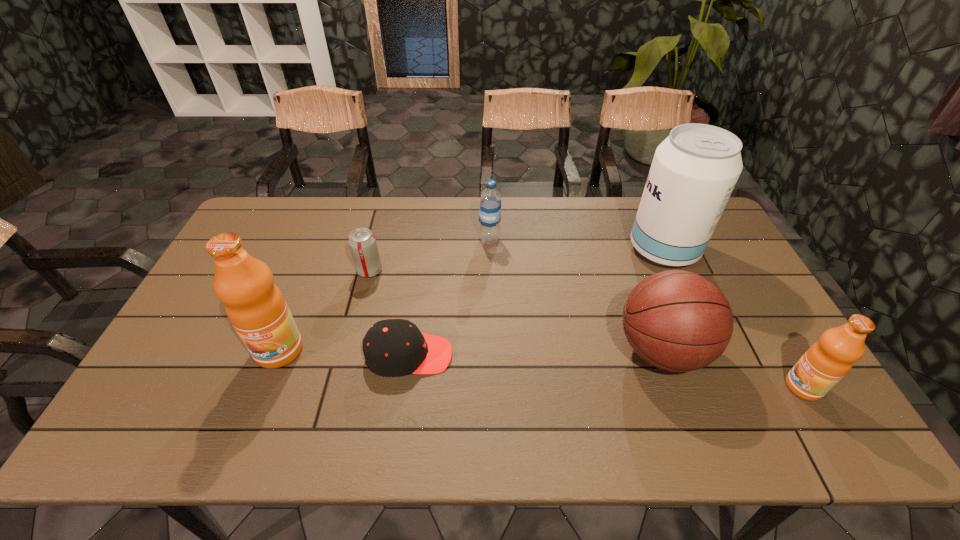
The height and width of the screenshot is (540, 960). I want to click on basketball, so click(x=679, y=321).

Locate an element on the screen. Image resolution: width=960 pixels, height=540 pixels. vacant point located 0.050m on the label side of the farther fruit juice is located at coordinates (264, 388).

Where is `free space located on the label side of the rightmost object`? The width and height of the screenshot is (960, 540). free space located on the label side of the rightmost object is located at coordinates (664, 387).

The image size is (960, 540). In order to click on blank area located 0.060m on the label side of the rightmost object in this screenshot , I will do `click(761, 387)`.

I want to click on vacant space located on the label side of the rightmost object, so click(737, 387).

The height and width of the screenshot is (540, 960). What are the coordinates of `free space located on the label of the water bottle` in the screenshot? It's located at (422, 239).

Locate an element on the screen. free spot located on the label of the water bottle is located at coordinates click(449, 239).

The image size is (960, 540). Find the location of `free point located on the label of the water bottle`. free point located on the label of the water bottle is located at coordinates (437, 239).

The image size is (960, 540). I want to click on free location located on the left of the alcohol, so click(535, 250).

The width and height of the screenshot is (960, 540). I want to click on free location located 0.070m on the left of the soda can, so click(334, 271).